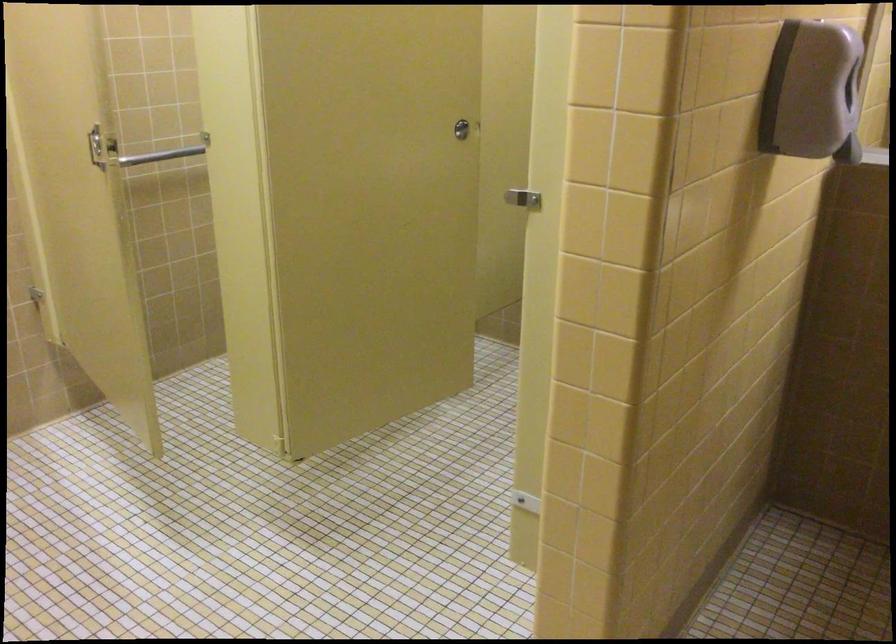
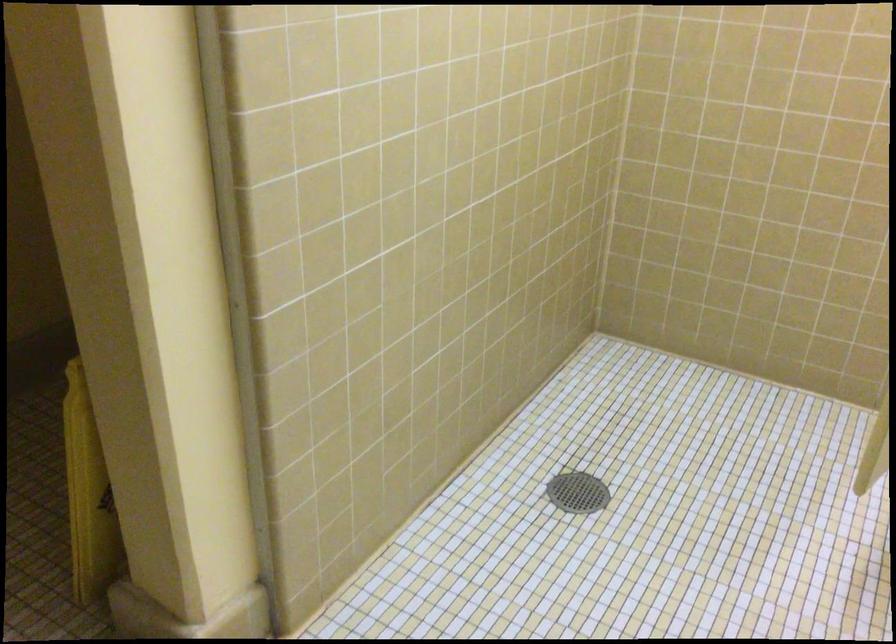
The images are taken continuously from a first-person perspective. In which direction is your viewpoint rotating?

The camera rotated toward left-down.